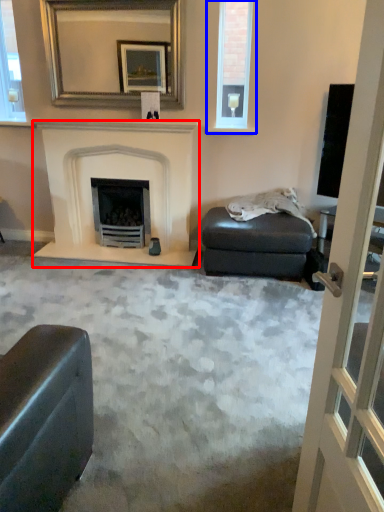
Question: Which object appears farthest to the camera in this image, fireplace (highlighted by a red box) or window (highlighted by a blue box)?

Choices:
 (A) fireplace
 (B) window

Answer: (B)